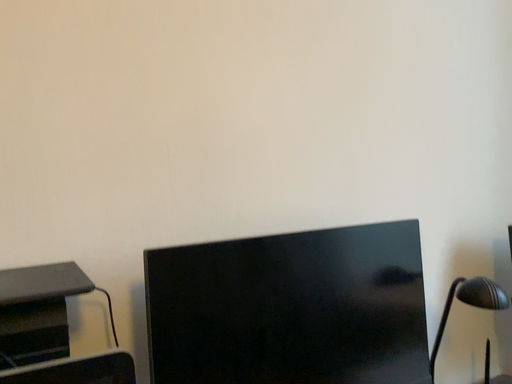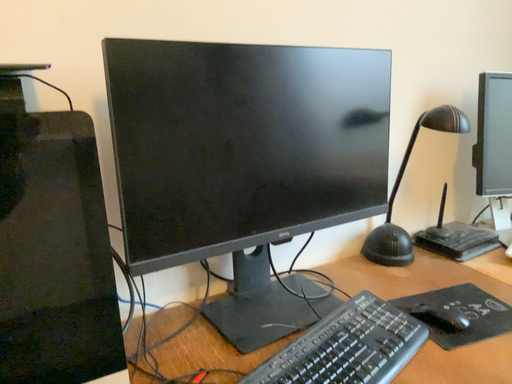
Question: Which way did the camera rotate in the video?

Choices:
 (A) rotated downward
 (B) rotated upward

Answer: (A)